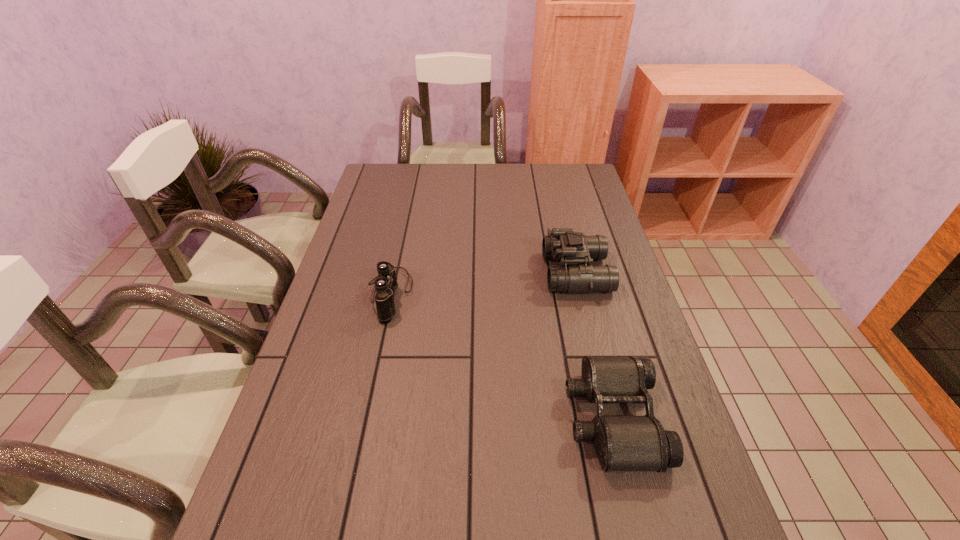
Where is `free region located through the eyepieces of the shortest object`? The image size is (960, 540). free region located through the eyepieces of the shortest object is located at coordinates (418, 418).

Identify the location of vacant area situated 0.400m through the eyepieces of the shortest object. (386, 418).

Identify the location of object located in the left edge section of the desktop. (386, 283).

Where is `vacant space at the far edge`? Image resolution: width=960 pixels, height=540 pixels. vacant space at the far edge is located at coordinates (551, 192).

I want to click on vacant area at the left edge, so click(377, 242).

This screenshot has height=540, width=960. I want to click on free space at the right edge, so click(x=610, y=224).

This screenshot has height=540, width=960. What are the coordinates of `vacant space at the far left corner of the desktop` in the screenshot? It's located at (389, 182).

What are the coordinates of `free space at the far right corner of the desktop` in the screenshot? It's located at (567, 192).

Identify the location of vacant area that lies between the tallest binoculars and the leftmost object. (483, 284).

Locate an element on the screen. The width and height of the screenshot is (960, 540). blank region between the leftmost object and the shortest binoculars is located at coordinates (501, 356).